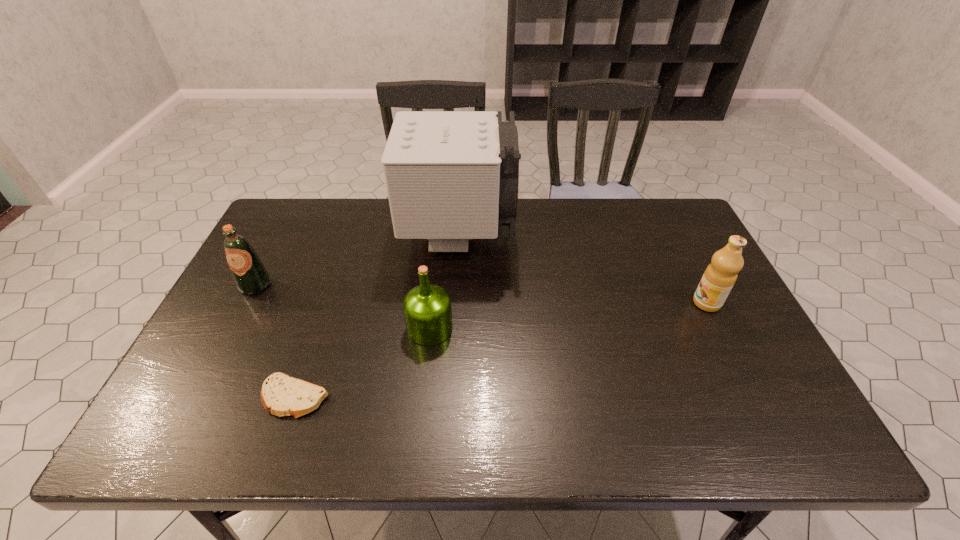
Find the location of a particular element. The width and height of the screenshot is (960, 540). vacant area situated 0.170m on the label of the rightmost olive oil is located at coordinates (630, 303).

Image resolution: width=960 pixels, height=540 pixels. What are the coordinates of `vacant area located 0.180m on the front-facing side of the leftmost olive oil` in the screenshot? It's located at (222, 350).

The width and height of the screenshot is (960, 540). Identify the location of vacant space located 0.050m on the right of the second olive oil from left to right. coord(472,328).

Where is `vacant space located 0.050m on the back of the shortest object`? vacant space located 0.050m on the back of the shortest object is located at coordinates (308, 358).

Find the location of a particular element. object positioned at the far edge is located at coordinates (451, 176).

This screenshot has width=960, height=540. Identify the location of object that is at the near edge. (281, 395).

I want to click on object that is positioned at the left edge, so click(x=251, y=277).

The width and height of the screenshot is (960, 540). What are the coordinates of `object located in the right edge section of the desktop` in the screenshot? It's located at (721, 274).

Identify the location of vacant space at the far edge of the desktop. (357, 218).

The image size is (960, 540). In the image, there is a desktop. What are the coordinates of `free region at the near edge` in the screenshot? It's located at (288, 437).